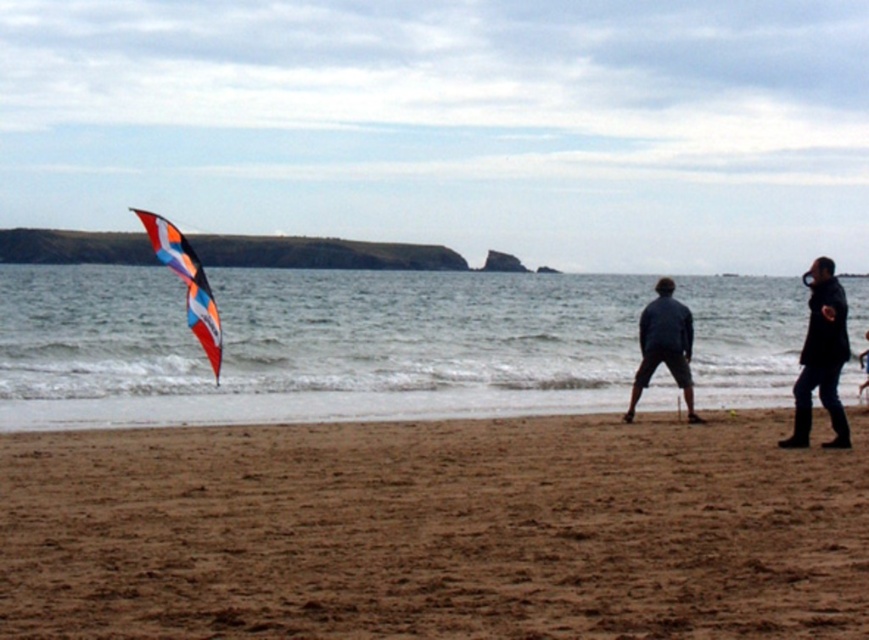
You are standing on the beach and see two points marked in the image. Which point is closer to you, point [536,289] or point [649,305]?

Point [536,289] is closer to you because it is further to the camera than point [649,305].

You are standing at the beach and see two points marked on the sand. The first point is at coordinates point (x=826, y=269) and the second is at point (x=151, y=220). Which point is closer to you?

Point (x=826, y=269) is further to the camera than point (x=151, y=220), so the point closer to you is point (x=151, y=220).